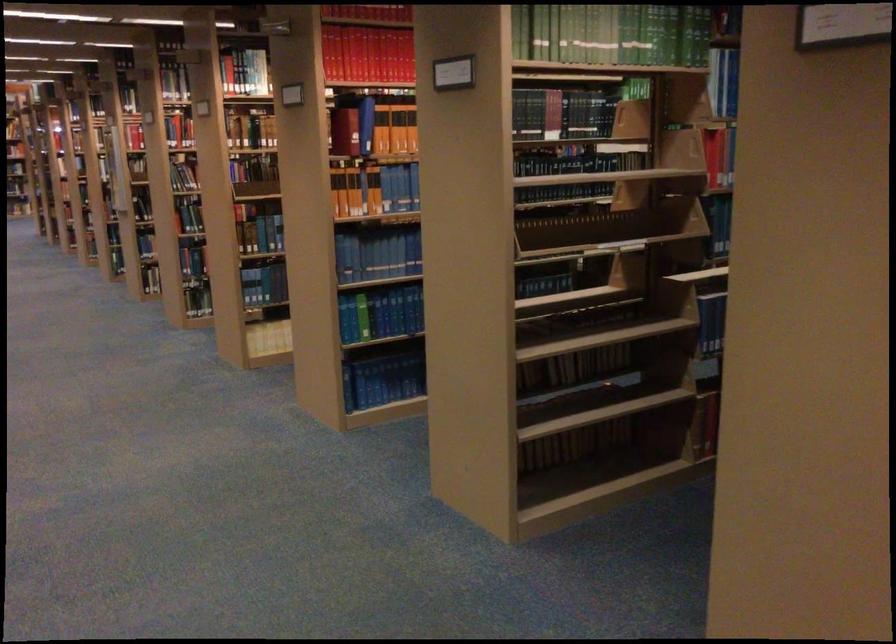
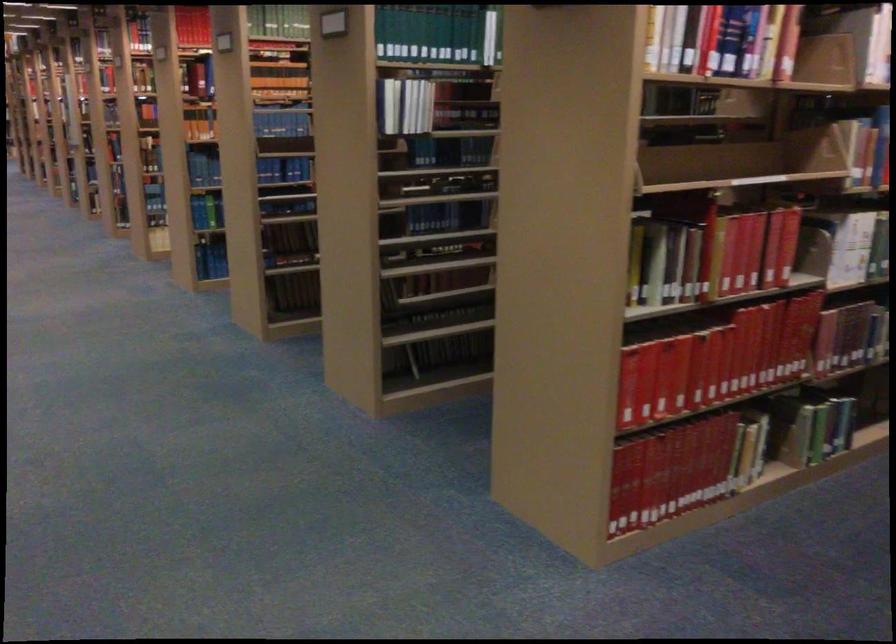
Question: I am providing you with two images of the same scene from different viewpoints. After the viewpoint changes to image2, which objects are now occluded?

Choices:
 (A) green book
 (B) blue book
 (C) orange book
 (D) pink spray trigger

Answer: (C)